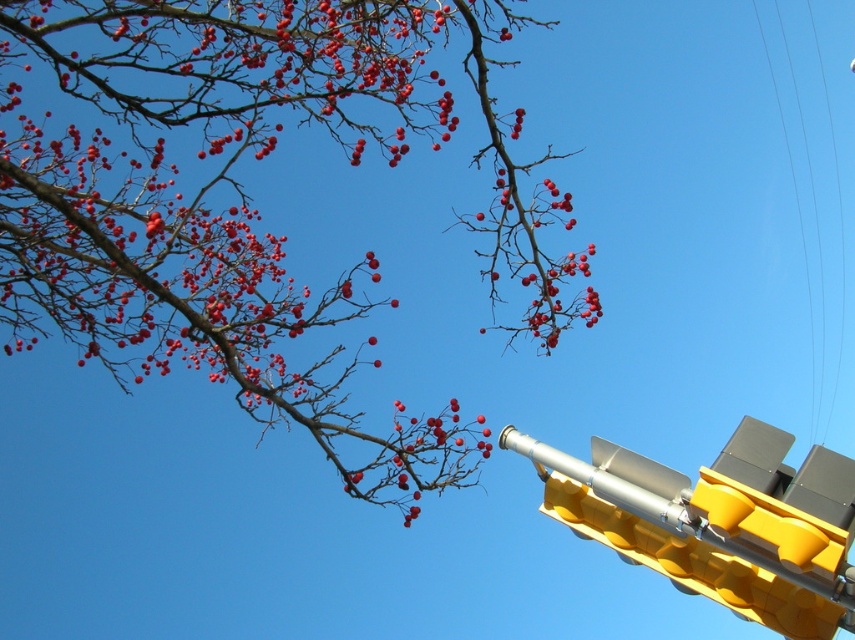
You are a photographer standing in the middle of the scene trying to capture a clear shot of the yellow plastic traffic light at lower right. However, the smooth red berries at upper left are blocking your view. Can you shift your position to the left or right to avoid the berries?

The yellow plastic traffic light at lower right is behind the smooth red berries at upper left, so moving to the left or right might help you avoid the berries and get a clear shot.

You are standing in front of the tree with red berries and the yellow traffic light. If you were to walk towards the tree, which of the two points, point (360, 136) or point (687, 532), would you encounter first?

Point (360, 136) is closer to you than point (687, 532), so you would encounter point (360, 136) first when walking towards the tree.